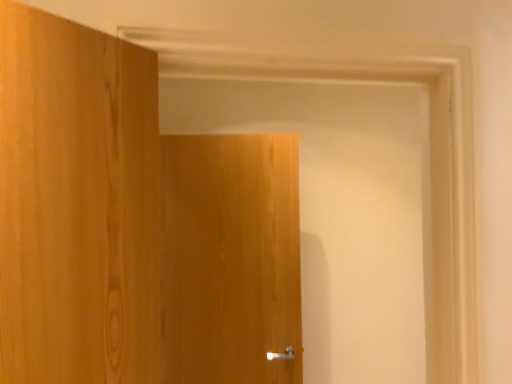
Where is `light brown wood door at center`? Image resolution: width=512 pixels, height=384 pixels. light brown wood door at center is located at coordinates (231, 257).

The height and width of the screenshot is (384, 512). What do you see at coordinates (231, 257) in the screenshot?
I see `light brown wood door at center` at bounding box center [231, 257].

Find the location of a particular element. light brown wood door at center is located at coordinates (231, 257).